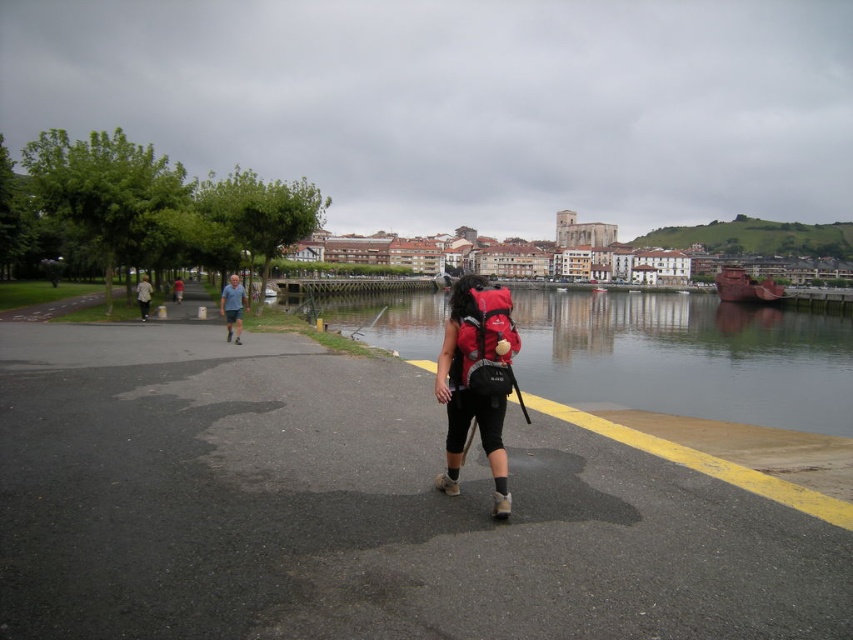
Who is more distant from viewer, (x=473, y=392) or (x=225, y=308)?

The point (x=225, y=308) is behind.

Can you confirm if matte red backpack at center is taller than gray fabric shorts at left?

Incorrect, matte red backpack at center's height is not larger of gray fabric shorts at left's.

The image size is (853, 640). Find the location of `matte red backpack at center`. matte red backpack at center is located at coordinates (485, 342).

Locate an element on the screen. matte red backpack at center is located at coordinates (485, 342).

Can you confirm if gray fabric shorts at left is shorter than light gray fabric pants at center?

In fact, gray fabric shorts at left may be taller than light gray fabric pants at center.

Does point (231, 298) come in front of point (178, 284)?

Yes, it is in front of point (178, 284).

Locate an element on the screen. Image resolution: width=853 pixels, height=640 pixels. gray fabric shorts at left is located at coordinates (231, 307).

In the scene shown: Is gray fabric shorts at left wider than light gray fabric jacket at left?

Correct, the width of gray fabric shorts at left exceeds that of light gray fabric jacket at left.

Can you confirm if gray fabric shorts at left is positioned below light gray fabric jacket at left?

Yes.

What do you see at coordinates (231, 307) in the screenshot? This screenshot has width=853, height=640. I see `gray fabric shorts at left` at bounding box center [231, 307].

The height and width of the screenshot is (640, 853). In order to click on gray fabric shorts at left in this screenshot , I will do `click(231, 307)`.